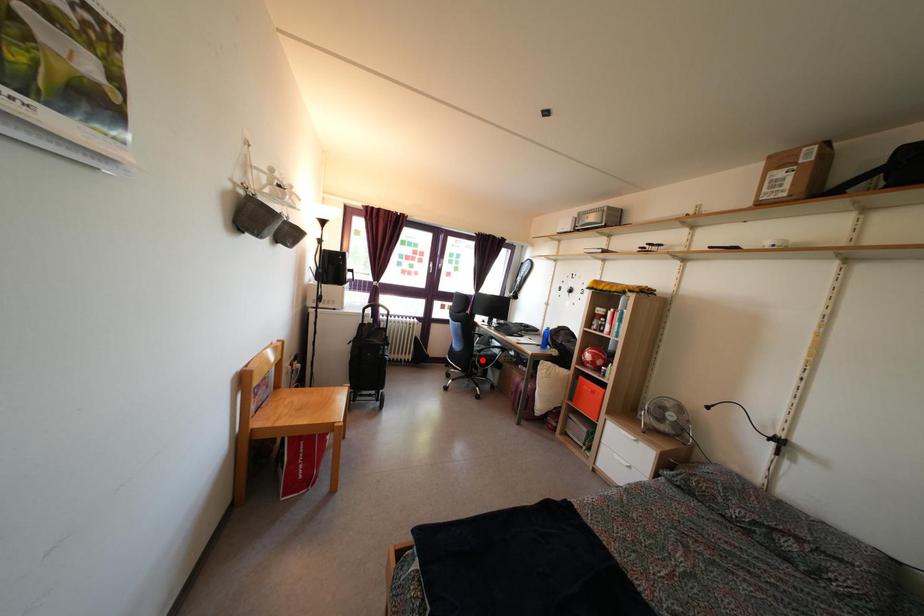
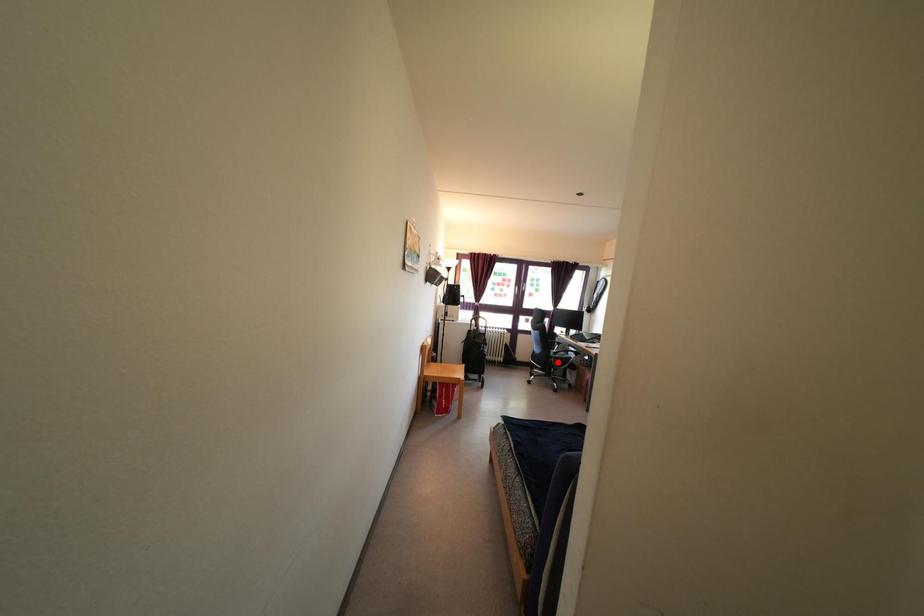
I am providing you with two images of the same scene from different viewpoints. A red point is marked on the first image and another point is marked on the second image. Are the points marked in image1 and image2 representing the same 3D position?

Yes